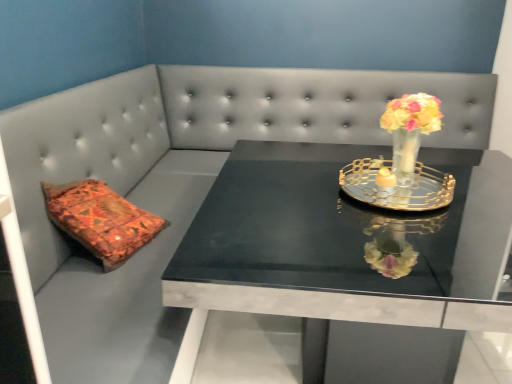
At what (x,y) coordinates should I click in order to perform the action: click on gold metallic tray at center. Please return your answer as a coordinate pair (x, y). This screenshot has height=384, width=512. Looking at the image, I should click on (396, 186).

In order to click on black marble table at center in this screenshot , I will do `click(347, 249)`.

Can you confirm if translucent glass vase at upper right is taller than black marble table at center?

In fact, translucent glass vase at upper right may be shorter than black marble table at center.

Considering the relative sizes of translucent glass vase at upper right and black marble table at center in the image provided, is translucent glass vase at upper right smaller than black marble table at center?

Correct, translucent glass vase at upper right occupies less space than black marble table at center.

From a real-world perspective, is translucent glass vase at upper right positioned above or below black marble table at center?

translucent glass vase at upper right is above black marble table at center.

Is translucent glass vase at upper right with gold metallic tray at center?

No, translucent glass vase at upper right is not with gold metallic tray at center.

From the image's perspective, which one is positioned higher, translucent glass vase at upper right or gold metallic tray at center?

From the image's view, translucent glass vase at upper right is above.

Does translucent glass vase at upper right lie behind gold metallic tray at center?

Yes, the depth of translucent glass vase at upper right is greater than that of gold metallic tray at center.

Which object is thinner, translucent glass vase at upper right or gold metallic tray at center?

Thinner between the two is translucent glass vase at upper right.

Based on their sizes in the image, would you say black marble table at center is bigger or smaller than translucent glass vase at upper right?

Considering their sizes, black marble table at center takes up more space than translucent glass vase at upper right.

Is point (336, 168) closer to camera compared to point (417, 102)?

That is False.

Is black marble table at center not inside translucent glass vase at upper right?

Indeed, black marble table at center is completely outside translucent glass vase at upper right.

Is black marble table at center in contact with translucent glass vase at upper right?

black marble table at center and translucent glass vase at upper right are clearly separated.

At what (x,y) coordinates should I click in order to perform the action: click on candle holder lying on the right of black marble table at center. Please return your answer as a coordinate pair (x, y). Looking at the image, I should click on (396, 186).

Consider the image. Are gold metallic tray at center and black marble table at center located far from each other?

Actually, gold metallic tray at center and black marble table at center are a little close together.

Is gold metallic tray at center at the right side of black marble table at center?

Indeed, gold metallic tray at center is positioned on the right side of black marble table at center.

From a real-world perspective, which is physically below, gold metallic tray at center or translucent glass vase at upper right?

gold metallic tray at center.

Measure the distance between gold metallic tray at center and translucent glass vase at upper right.

gold metallic tray at center is 4.88 inches away from translucent glass vase at upper right.

Between gold metallic tray at center and translucent glass vase at upper right, which one appears on the right side from the viewer's perspective?

From the viewer's perspective, translucent glass vase at upper right appears more on the right side.

Is the depth of gold metallic tray at center less than that of translucent glass vase at upper right?

Yes, it is.

Would you say black marble table at center contains gold metallic tray at center?

No, gold metallic tray at center is located outside of black marble table at center.

Is black marble table at center positioned far away from gold metallic tray at center?

That's not correct — black marble table at center is a little close to gold metallic tray at center.

Looking at their sizes, would you say black marble table at center is wider or thinner than gold metallic tray at center?

In the image, black marble table at center appears to be wider than gold metallic tray at center.

The width and height of the screenshot is (512, 384). There is a black marble table at center. In order to click on floral arrangement above it (from a real-world perspective) in this screenshot , I will do `click(409, 131)`.

You are a GUI agent. You are given a task and a screenshot of the screen. Output one action in this format:
    pyautogui.click(x=<x>, y=<y>)
    Task: Click on the floral arrangement that is behind the gold metallic tray at center
    This screenshot has height=384, width=512.
    Given the screenshot: What is the action you would take?
    pyautogui.click(x=409, y=131)

Estimate the real-world distances between objects in this image. Which object is further from translucent glass vase at upper right, gold metallic tray at center or black marble table at center?

black marble table at center.

When comparing their distances from black marble table at center, does translucent glass vase at upper right or gold metallic tray at center seem further?

translucent glass vase at upper right is further to black marble table at center.

In the scene shown: When comparing their distances from gold metallic tray at center, does black marble table at center or translucent glass vase at upper right seem further?

Among the two, black marble table at center is located further to gold metallic tray at center.

Considering their positions, is black marble table at center positioned further to translucent glass vase at upper right than gold metallic tray at center?

black marble table at center is positioned further to the anchor translucent glass vase at upper right.

Looking at the image, which one is located closer to gold metallic tray at center, translucent glass vase at upper right or black marble table at center?

translucent glass vase at upper right is closer to gold metallic tray at center.

Looking at the image, which one is located closer to black marble table at center, gold metallic tray at center or translucent glass vase at upper right?

gold metallic tray at center is positioned closer to the anchor black marble table at center.

This screenshot has height=384, width=512. I want to click on candle holder between black marble table at center and translucent glass vase at upper right in the front-back direction, so click(x=396, y=186).